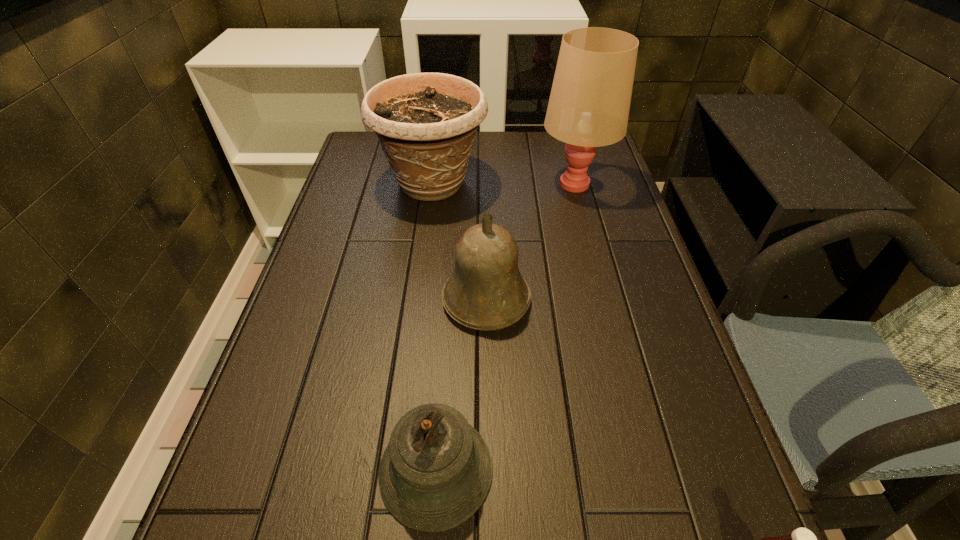
I want to click on the tallest object, so pos(589,104).

This screenshot has height=540, width=960. I want to click on flowerpot, so click(426, 122).

Where is `the third nearest object`? The height and width of the screenshot is (540, 960). the third nearest object is located at coordinates coord(486,291).

Find the location of `the farther bell`. the farther bell is located at coordinates (486, 291).

Where is `the fourth farthest object`? This screenshot has width=960, height=540. the fourth farthest object is located at coordinates (436, 471).

Where is `the nearer bell`? The height and width of the screenshot is (540, 960). the nearer bell is located at coordinates (436, 471).

Find the location of a particular element. This screenshot has width=960, height=540. free space located 0.060m on the front of the tallest object is located at coordinates (585, 218).

The width and height of the screenshot is (960, 540). Identify the location of free space located 0.270m on the right of the flowerpot. (577, 184).

Identify the location of vacant area situated on the front of the third farthest object. (488, 414).

I want to click on vacant space located on the back of the shorter bell, so click(x=449, y=279).